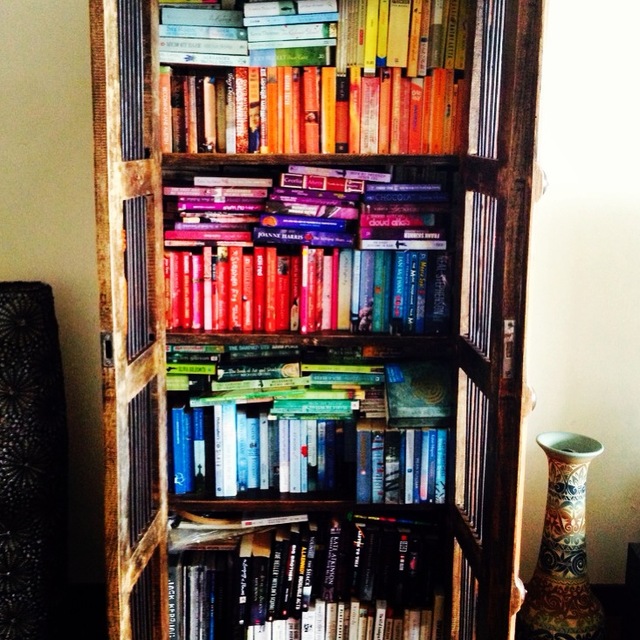
In order to click on doors in this screenshot , I will do `click(134, 317)`, `click(499, 285)`.